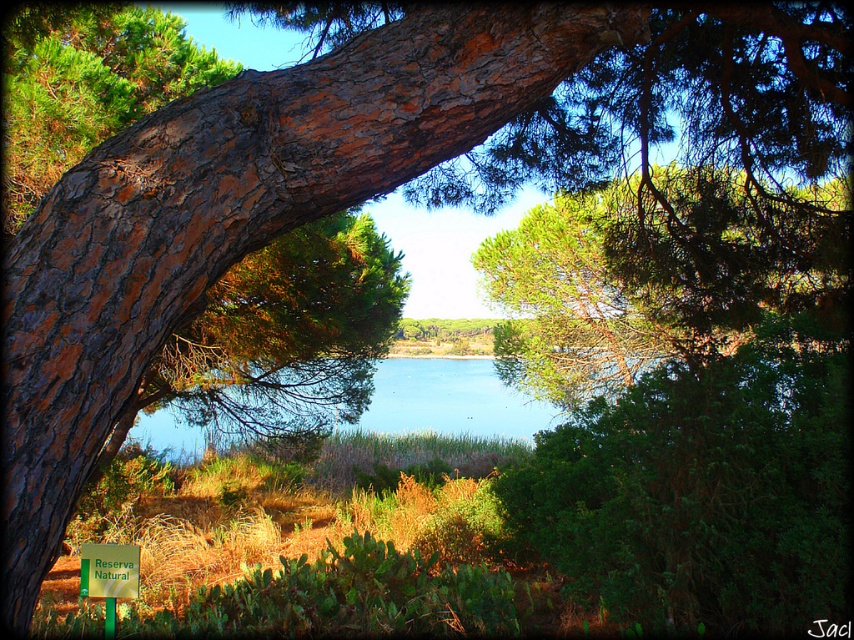
Question: Can you confirm if blue water at center is bigger than green plastic sign at center?

Choices:
 (A) no
 (B) yes

Answer: (B)

Question: Among these points, which one is farthest from the camera?

Choices:
 (A) (445, 404)
 (B) (82, 582)

Answer: (A)

Question: Can you confirm if blue water at center is smaller than green plastic sign at center?

Choices:
 (A) yes
 (B) no

Answer: (B)

Question: Is blue water at center in front of green plastic sign at center?

Choices:
 (A) yes
 (B) no

Answer: (B)

Question: Which of the following is the closest to the observer?

Choices:
 (A) green plastic sign at center
 (B) blue water at center

Answer: (A)